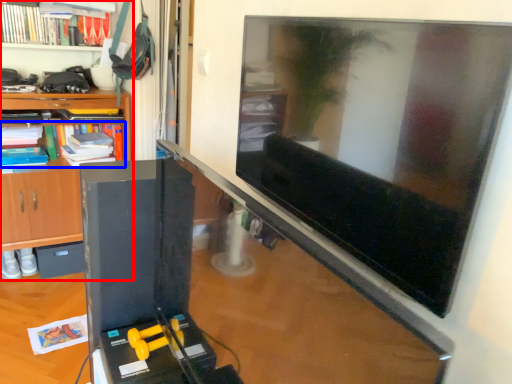
Question: Which point is further to the camera, shelf (highlighted by a red box) or book (highlighted by a blue box)?

Choices:
 (A) shelf
 (B) book

Answer: (B)